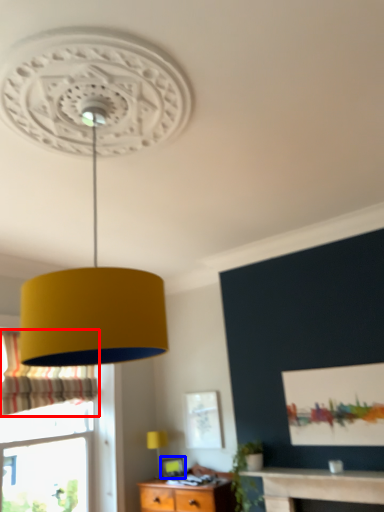
Question: Among these objects, which one is nearest to the camera, curtain (highlighted by a red box) or picture frame (highlighted by a blue box)?

Choices:
 (A) curtain
 (B) picture frame

Answer: (A)